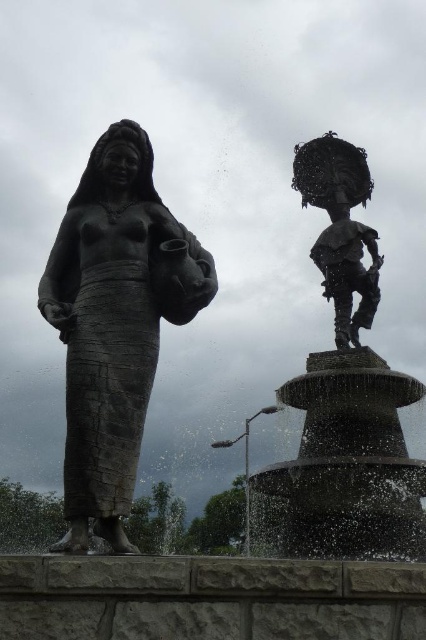
The width and height of the screenshot is (426, 640). I want to click on bronze statue at left, so click(x=115, y=323).

Does bronze statue at left lie in front of polished bronze statue at upper right?

Yes, bronze statue at left is closer to the viewer.

Measure the distance between bronze statue at left and camera.

bronze statue at left and camera are 171.20 feet apart from each other.

At what (x,y) coordinates should I click in order to perform the action: click on bronze statue at left. Please return your answer as a coordinate pair (x, y). Looking at the image, I should click on (115, 323).